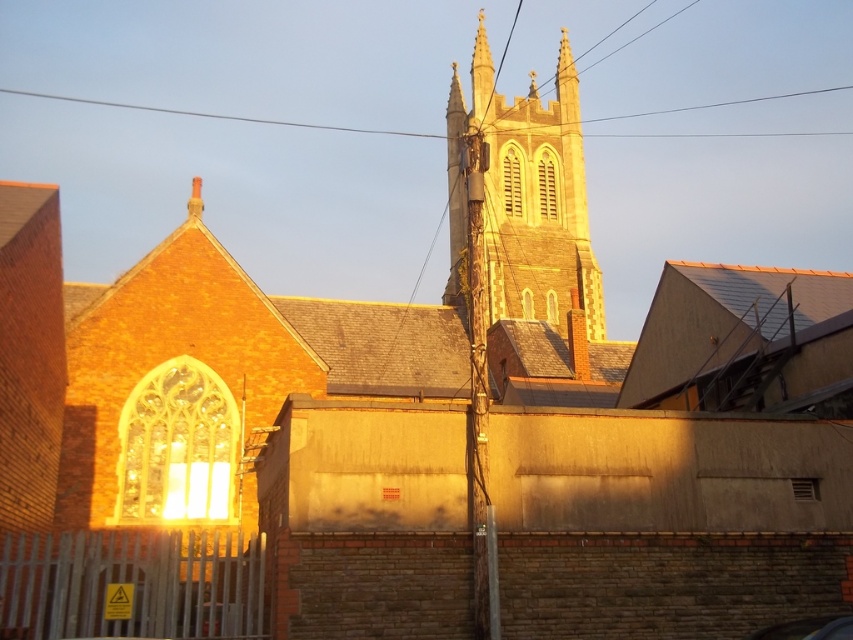
Which is more to the left, smooth wire at upper center or metallic silver car at lower right?

Positioned to the left is smooth wire at upper center.

Who is more forward, (405,134) or (811,634)?

Point (811,634) is in front.

This screenshot has width=853, height=640. I want to click on smooth wire at upper center, so click(x=215, y=115).

Find the location of a particular element. The width and height of the screenshot is (853, 640). black wire at upper center is located at coordinates (210, 115).

Which is behind, point (708, 134) or point (767, 632)?

The point (708, 134) is behind.

Identify the location of black wire at upper center. The image size is (853, 640). (210, 115).

Based on the photo, how distant is brown stone tower at upper center from metallic silver car at lower right?

They are 72.36 meters apart.

Does brown stone tower at upper center appear on the left side of metallic silver car at lower right?

Yes, brown stone tower at upper center is to the left of metallic silver car at lower right.

What do you see at coordinates (525, 196) in the screenshot? I see `brown stone tower at upper center` at bounding box center [525, 196].

Where is `brown stone tower at upper center`? brown stone tower at upper center is located at coordinates (525, 196).